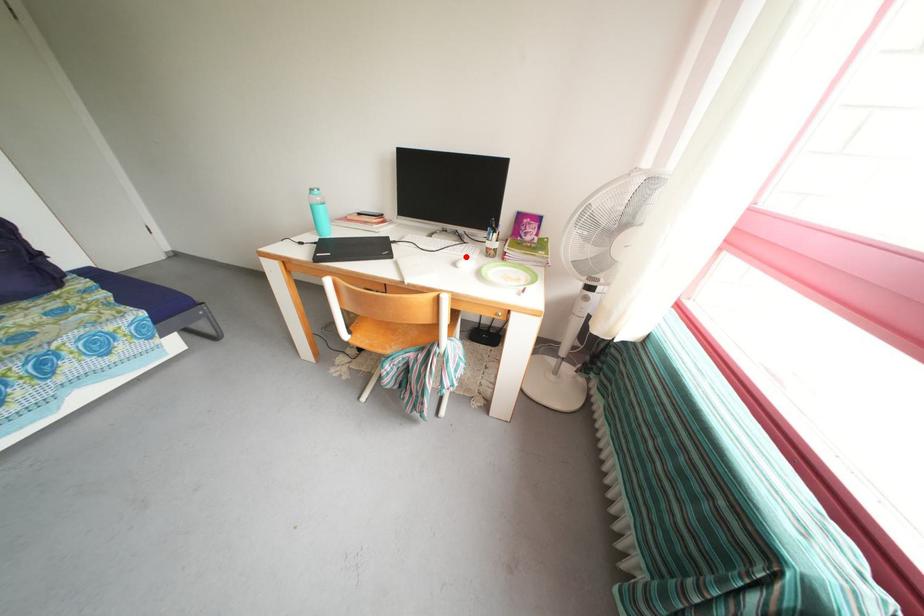
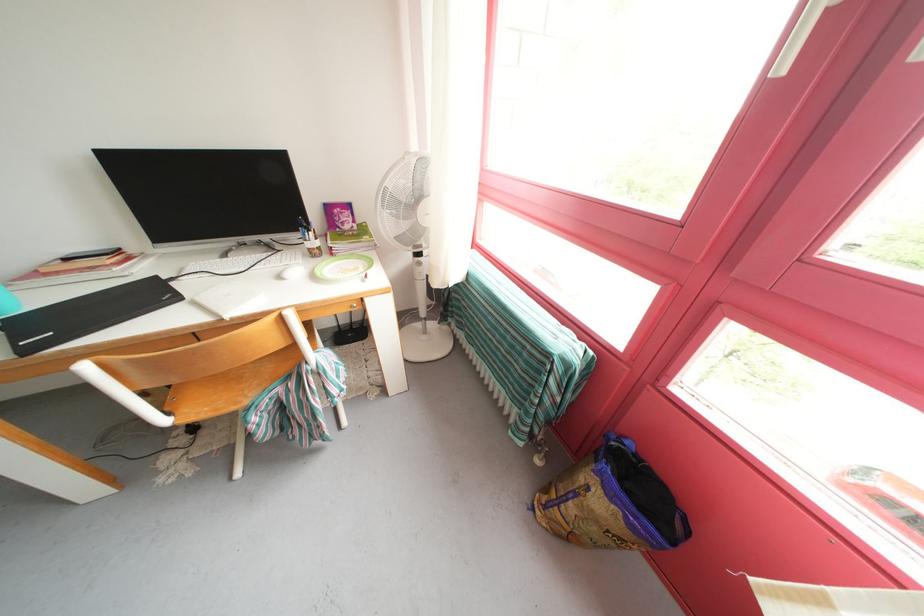
The point at the highlighted location is marked in the first image. Where is the corresponding point in the second image?

(284, 267)